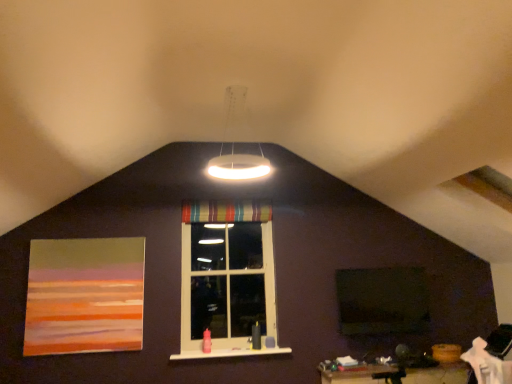
Question: From the image's perspective, relative to striped fabric curtain at center, is white glossy ring light at upper center above or below?

Choices:
 (A) below
 (B) above

Answer: (B)

Question: In the image, is white glossy ring light at upper center positioned in front of or behind striped fabric curtain at center?

Choices:
 (A) behind
 (B) front

Answer: (B)

Question: Which is nearer to the striped fabric window at center?

Choices:
 (A) matte acrylic painting at left
 (B) white glossy ring light at upper center
 (C) green matte window screen at center
 (D) striped fabric curtain at center
 (E) white glossy wood at center

Answer: (D)

Question: Which object is positioned farthest from the matte acrylic painting at left?

Choices:
 (A) white glossy ring light at upper center
 (B) green matte window screen at center
 (C) striped fabric window at center
 (D) white glossy wood at center
 (E) striped fabric curtain at center

Answer: (B)